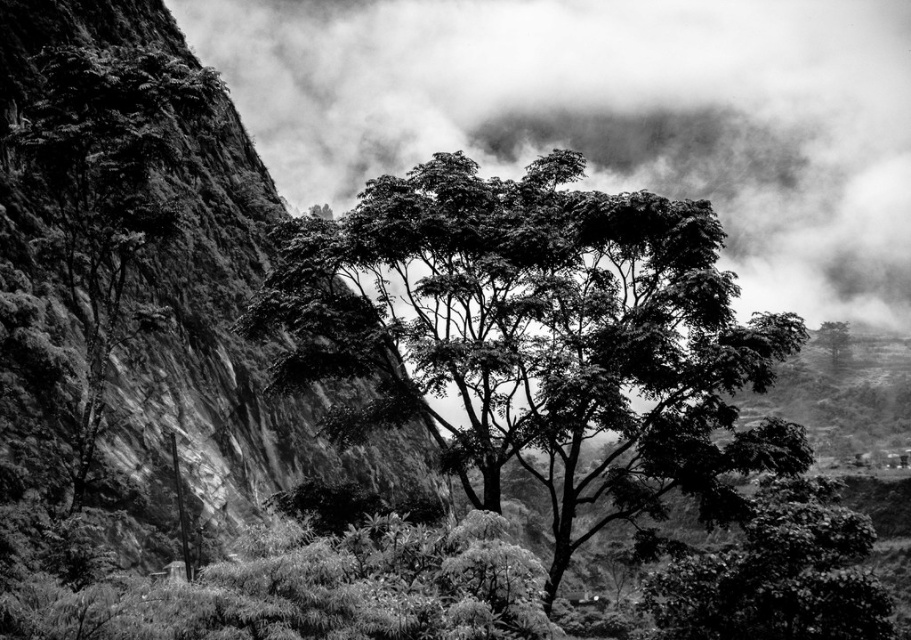
Question: Among these points, which one is farthest from the camera?

Choices:
 (A) (846, 340)
 (B) (50, 150)
 (C) (780, 56)
 (D) (589, 368)

Answer: (C)

Question: Can you confirm if dark green leafy tree at center is positioned to the right of green leafy tree at upper right?

Choices:
 (A) yes
 (B) no

Answer: (B)

Question: Estimate the real-world distances between objects in this image. Which object is closer to the dark green leafy tree at center?

Choices:
 (A) green leafy tree at upper right
 (B) cloudy sky at upper center

Answer: (A)

Question: Is cloudy sky at upper center positioned in front of dark green leafy tree at center?

Choices:
 (A) no
 (B) yes

Answer: (A)

Question: Which of the following is the closest to the observer?

Choices:
 (A) (145, 99)
 (B) (821, 333)
 (C) (512, 280)

Answer: (A)

Question: Is dark green leafy tree at center wider than dark green leafy tree at left?

Choices:
 (A) no
 (B) yes

Answer: (B)